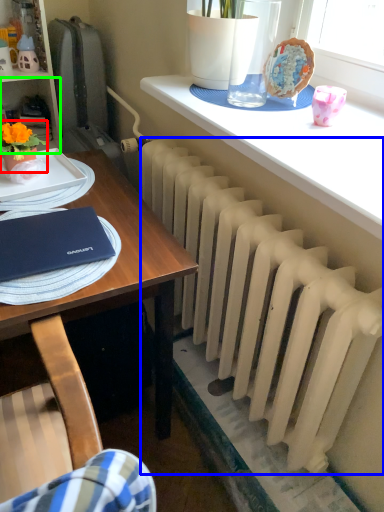
Question: Based on their relative distances, which object is nearer to houseplant (highlighted by a red box)? Choose from radiator (highlighted by a blue box) and shelf (highlighted by a green box).

Choices:
 (A) radiator
 (B) shelf

Answer: (B)